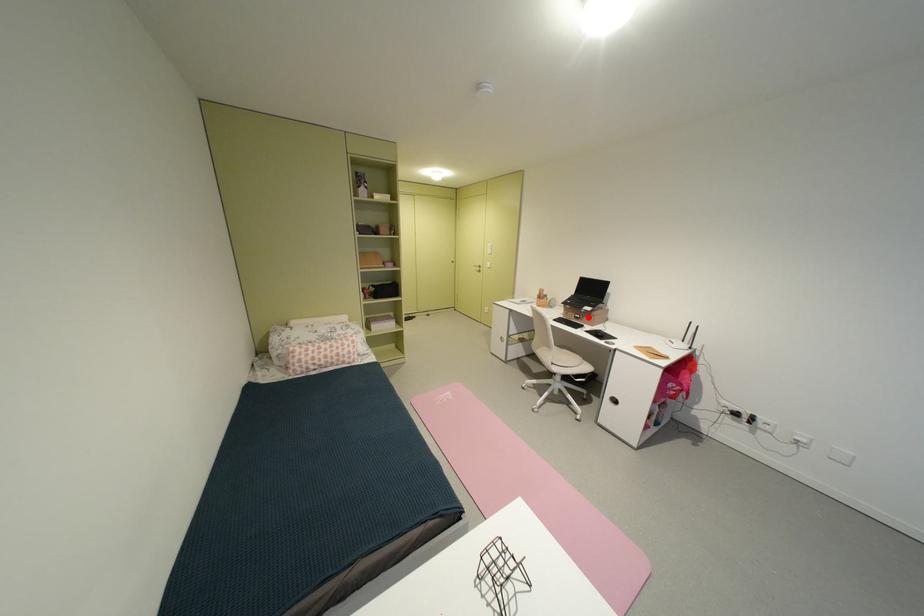
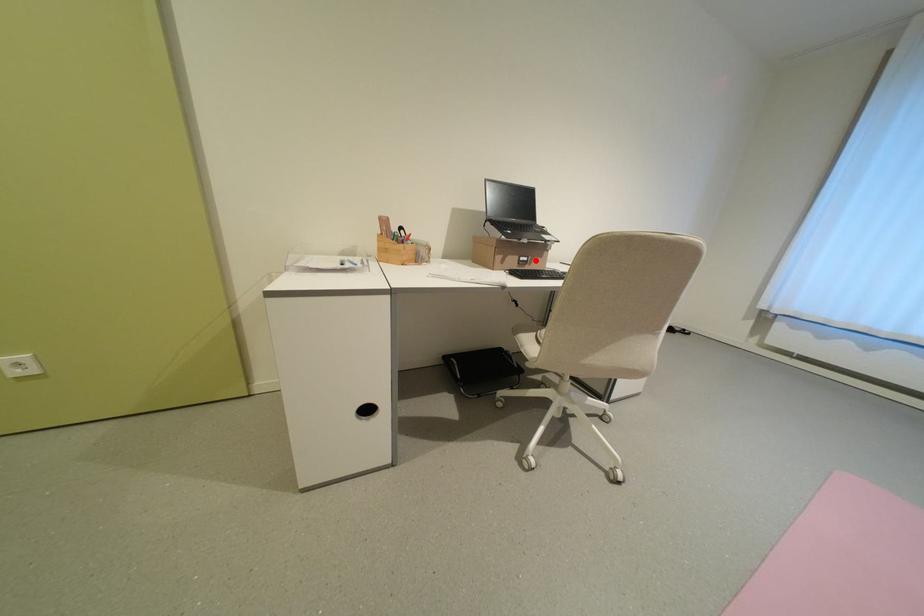
I am providing you with two images of the same scene from different viewpoints. A red point is marked on the first image and another point is marked on the second image. Is the red point in image1 aligned with the point shown in image2?

Yes